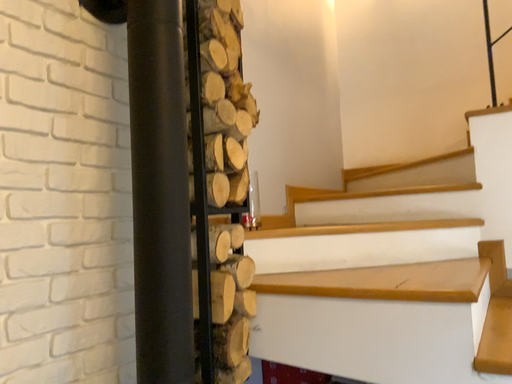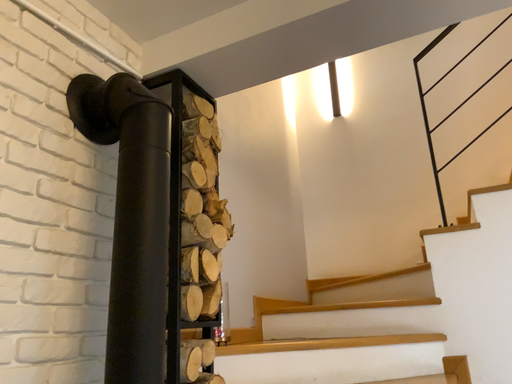
Question: How did the camera likely rotate when shooting the video?

Choices:
 (A) rotated downward
 (B) rotated upward

Answer: (B)